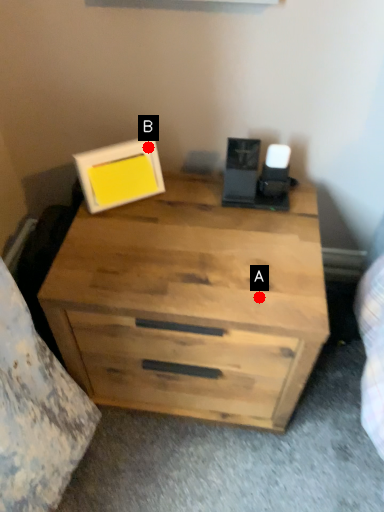
Question: Two points are circled on the image, labeled by A and B beside each circle. Which point appears farthest from the camera in this image?

Choices:
 (A) A is further
 (B) B is further

Answer: (B)